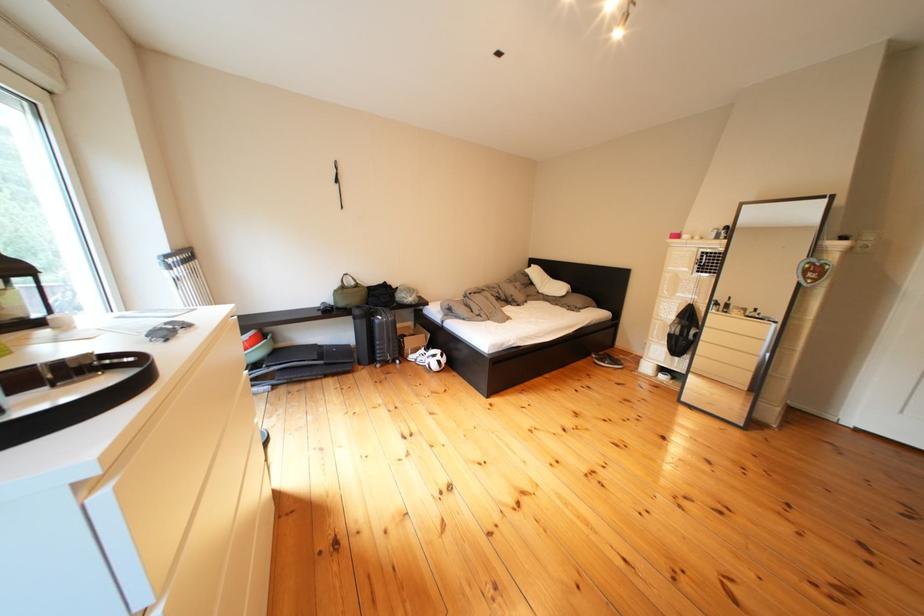
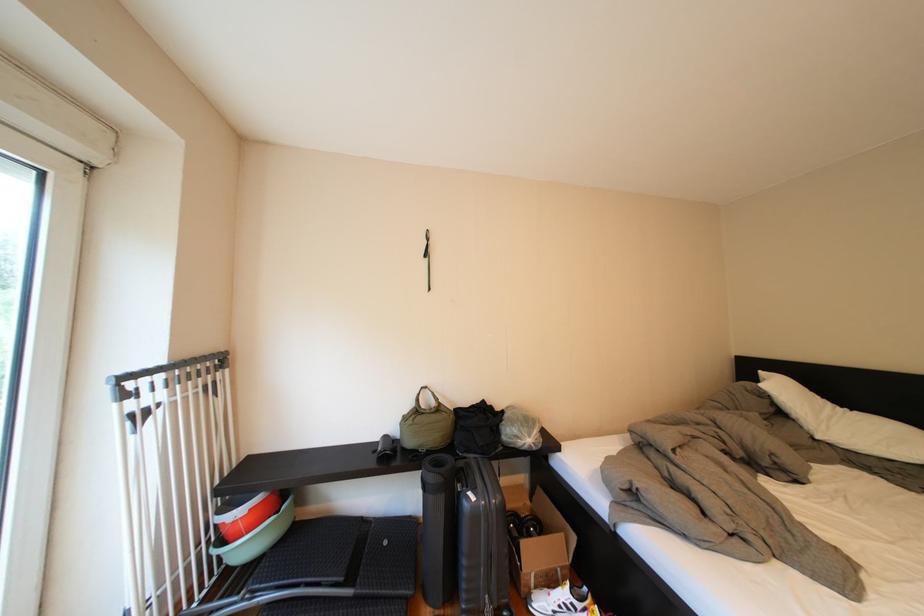
Find the pixel in the second image that matches point (394, 323) in the first image.

(487, 503)